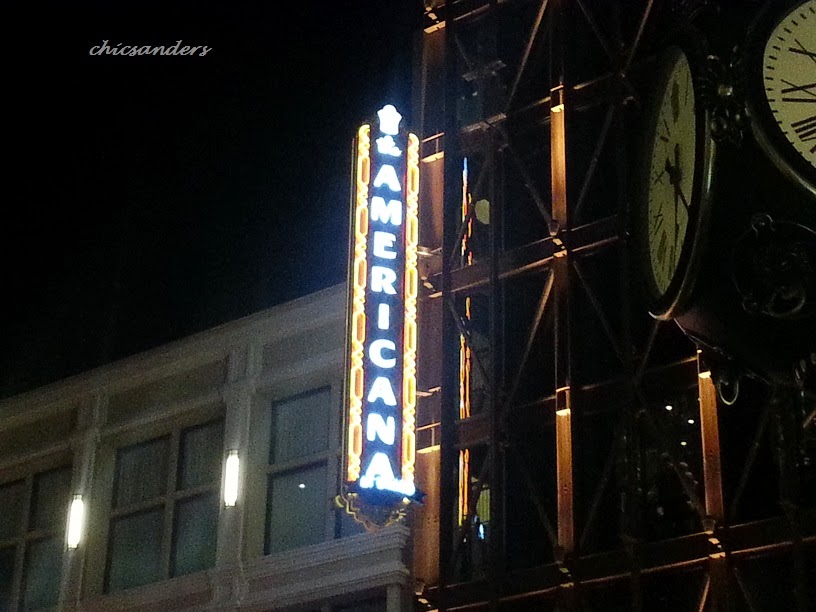
At what (x,y) coordinates should I click in order to perform the action: click on frame. Please return your answer as a coordinate pair (x, y). Looking at the image, I should click on (562, 334).